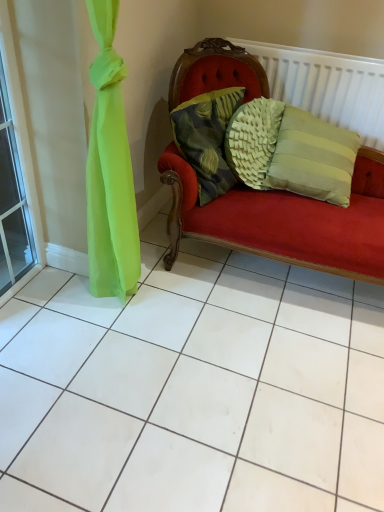
The height and width of the screenshot is (512, 384). What do you see at coordinates (22, 154) in the screenshot?
I see `transparent glass window at left` at bounding box center [22, 154].

What do you see at coordinates (207, 138) in the screenshot? This screenshot has height=512, width=384. I see `textured green pillow at center` at bounding box center [207, 138].

This screenshot has height=512, width=384. I want to click on transparent glass window at left, so click(x=22, y=154).

Does point (261, 50) come behind point (199, 124)?

Yes.

Between white textured radiator at upper right and textured green pillow at center, which one has smaller size?

With smaller size is textured green pillow at center.

Based on the photo, does white textured radiator at upper right lie behind textured green pillow at center?

Yes, white textured radiator at upper right is further from the camera.

Are white textured radiator at upper right and textured green pillow at center located far from each other?

Actually, white textured radiator at upper right and textured green pillow at center are a little close together.

Could you tell me if transparent glass window at left is facing textured green pillow at center?

No, transparent glass window at left does not turn towards textured green pillow at center.

Is transparent glass window at left not near textured green pillow at center?

transparent glass window at left is near textured green pillow at center, not far away.

Who is bigger, transparent glass window at left or textured green pillow at center?

textured green pillow at center.

From a real-world perspective, which is physically above, transparent glass window at left or textured green pillow at center?

In real-world perspective, textured green pillow at center is above.

In the image, there is a textured green pillow at center. At what (x,y) coordinates should I click in order to perform the action: click on window below it (from the image's perspective). Please return your answer as a coordinate pair (x, y). This screenshot has width=384, height=512. Looking at the image, I should click on (22, 154).

Choose the correct answer: Is textured green pillow at center inside transparent glass window at left or outside it?

textured green pillow at center is not inside transparent glass window at left, it's outside.

Is textured green pillow at center turned away from transparent glass window at left?

No, textured green pillow at center's orientation is not away from transparent glass window at left.

From the image's perspective, between textured green pillow at center and transparent glass window at left, who is located below?

From the image's view, transparent glass window at left is below.

Considering the sizes of objects transparent glass window at left and white textured radiator at upper right in the image provided, who is taller, transparent glass window at left or white textured radiator at upper right?

transparent glass window at left.

From the image's perspective, is transparent glass window at left above white textured radiator at upper right?

No, from the image's perspective, transparent glass window at left is not above white textured radiator at upper right.

Considering the sizes of objects transparent glass window at left and white textured radiator at upper right in the image provided, who is smaller, transparent glass window at left or white textured radiator at upper right?

With smaller size is transparent glass window at left.

Which is correct: transparent glass window at left is inside white textured radiator at upper right, or outside of it?

transparent glass window at left is not inside white textured radiator at upper right, it's outside.

Is white textured radiator at upper right shorter than transparent glass window at left?

Correct, white textured radiator at upper right is not as tall as transparent glass window at left.

This screenshot has width=384, height=512. I want to click on balustrade above the transparent glass window at left (from the image's perspective), so click(x=326, y=86).

Consider the image. Is white textured radiator at upper right to the left of transparent glass window at left from the viewer's perspective?

No, white textured radiator at upper right is not to the left of transparent glass window at left.

From a real-world perspective, which is physically below, textured green pillow at center or white textured radiator at upper right?

textured green pillow at center, from a real-world perspective.

Find the location of a particular element. balustrade positioned vertically above the textured green pillow at center (from a real-world perspective) is located at coordinates (326, 86).

Can white textured radiator at upper right be found inside textured green pillow at center?

Definitely not — white textured radiator at upper right is not inside textured green pillow at center.

Where is `balustrade that appears above the textured green pillow at center (from the image's perspective)`? balustrade that appears above the textured green pillow at center (from the image's perspective) is located at coordinates (326, 86).

Image resolution: width=384 pixels, height=512 pixels. Identify the location of pillow behind the transparent glass window at left. (207, 138).

When comparing their distances from textured green pillow at center, does transparent glass window at left or white textured radiator at upper right seem further?

transparent glass window at left is further to textured green pillow at center.

Based on their spatial positions, is white textured radiator at upper right or transparent glass window at left further from textured green pillow at center?

Among the two, transparent glass window at left is located further to textured green pillow at center.

Which object lies nearer to the anchor point transparent glass window at left, white textured radiator at upper right or textured green pillow at center?

Among the two, textured green pillow at center is located nearer to transparent glass window at left.

From the picture: From the image, which object appears to be farther from white textured radiator at upper right, textured green pillow at center or transparent glass window at left?

Based on the image, transparent glass window at left appears to be further to white textured radiator at upper right.

From the image, which object appears to be farther from transparent glass window at left, textured green pillow at center or white textured radiator at upper right?

The object further to transparent glass window at left is white textured radiator at upper right.

Considering their positions, is transparent glass window at left positioned closer to white textured radiator at upper right than textured green pillow at center?

textured green pillow at center lies closer to white textured radiator at upper right than the other object.

Find the location of `pillow situated between transparent glass window at left and white textured radiator at upper right from left to right`. pillow situated between transparent glass window at left and white textured radiator at upper right from left to right is located at coordinates (207, 138).